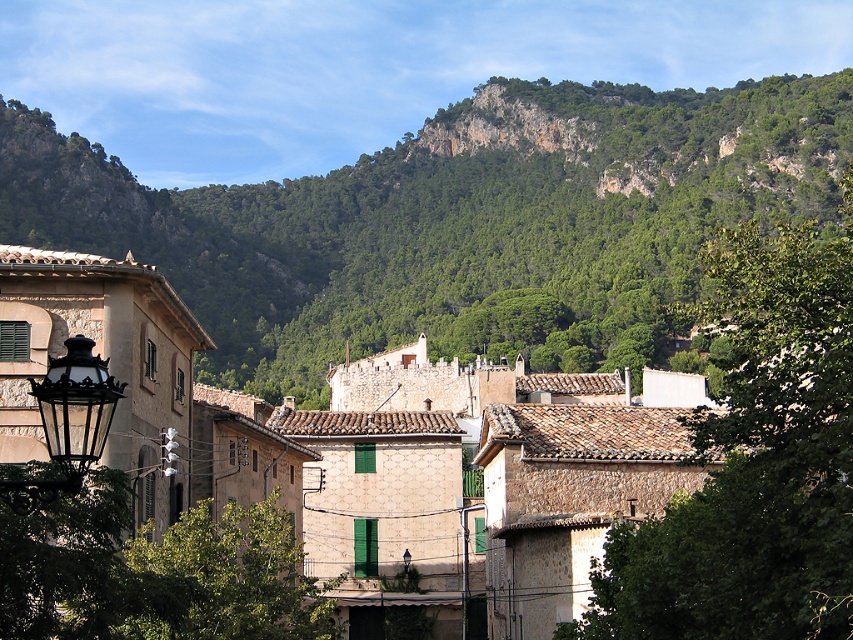
Is green leafy tree at upper center further to the viewer compared to black wrought iron streetlight at left?

Yes.

Looking at this image, can you confirm if green leafy tree at upper center is positioned to the right of black wrought iron streetlight at left?

Yes, green leafy tree at upper center is to the right of black wrought iron streetlight at left.

Does point (791, 266) lie behind point (74, 468)?

Yes, point (791, 266) is farther from viewer.

Image resolution: width=853 pixels, height=640 pixels. In order to click on green leafy tree at upper center in this screenshot , I will do `click(753, 460)`.

Consider the image. Is green leafy mountain at upper center closer to camera compared to black wrought iron streetlight at left?

No.

Is point (543, 353) behind point (96, 442)?

Yes.

Does point (645, 112) lie in front of point (80, 461)?

No, (645, 112) is behind (80, 461).

You are a GUI agent. You are given a task and a screenshot of the screen. Output one action in this format:
    pyautogui.click(x=<x>, y=<y>)
    Task: Click on the green leafy mountain at upper center
    Image resolution: width=853 pixels, height=640 pixels.
    Given the screenshot: What is the action you would take?
    pyautogui.click(x=454, y=221)

Does green leafy mountain at upper center have a lesser width compared to green leafy tree at upper center?

In fact, green leafy mountain at upper center might be wider than green leafy tree at upper center.

Where is `green leafy mountain at upper center`? green leafy mountain at upper center is located at coordinates (454, 221).